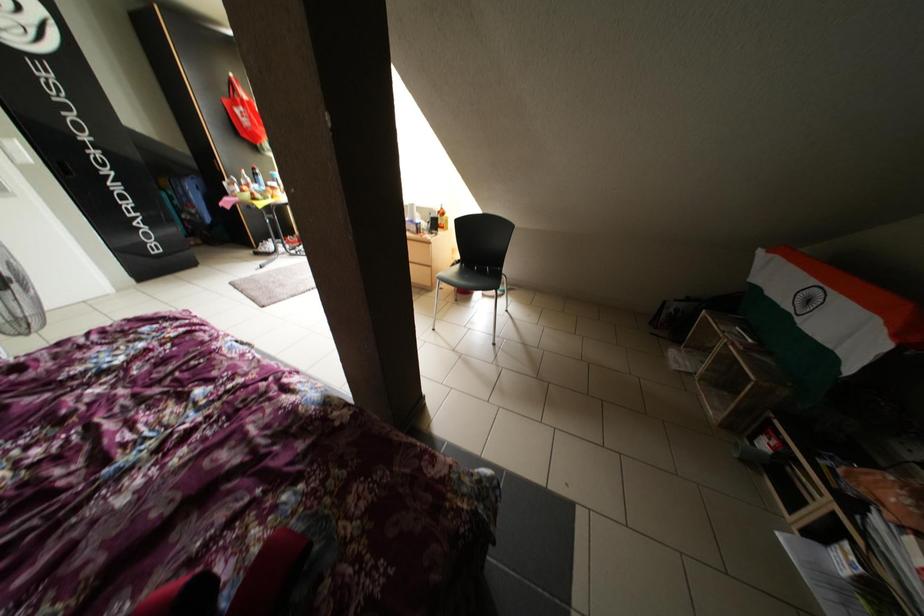
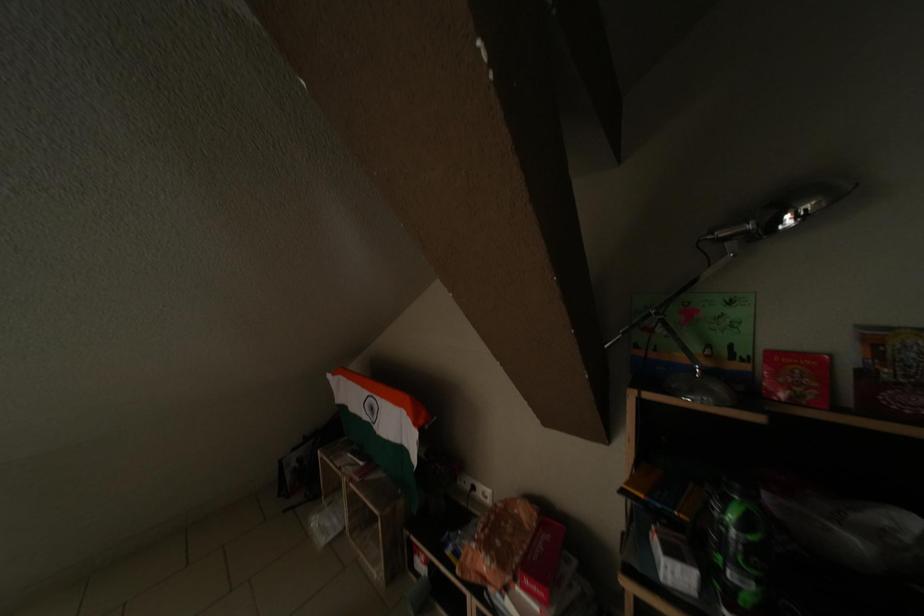
Question: Based on the continuous images, in which direction is the camera rotating? Reply with the corresponding letter.

Choices:
 (A) Left
 (B) Right
 (C) Up
 (D) Down

Answer: (B)